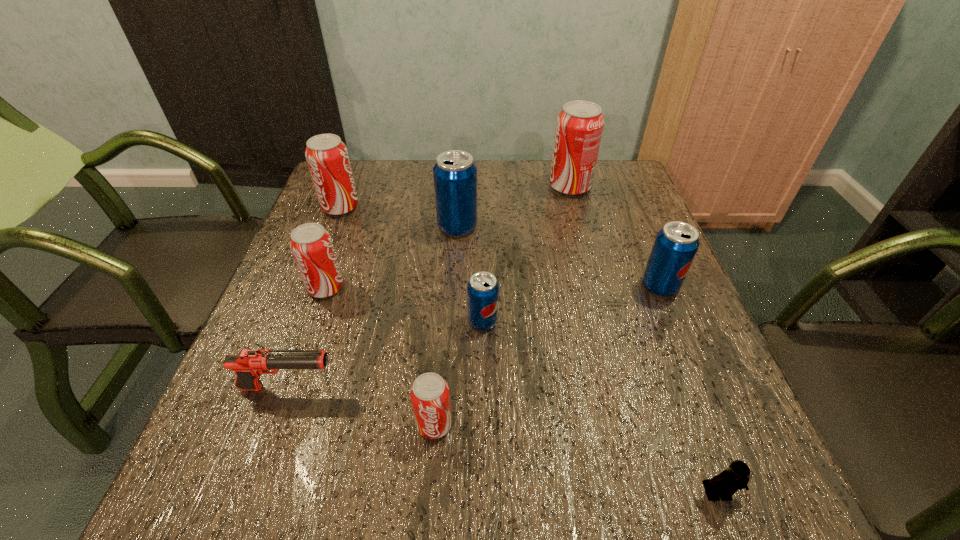
Where is `the eighth farthest object`? This screenshot has height=540, width=960. the eighth farthest object is located at coordinates (430, 397).

You are a GUI agent. You are given a task and a screenshot of the screen. Output one action in this format:
    pyautogui.click(x=<x>, y=<y>)
    Task: Click on the seventh farthest object
    Image resolution: width=960 pixels, height=540 pixels.
    Given the screenshot: What is the action you would take?
    pyautogui.click(x=248, y=364)

Where is `black gun`? This screenshot has height=540, width=960. black gun is located at coordinates (248, 364).

Where is `Lego`? This screenshot has width=960, height=540. Lego is located at coordinates (726, 484).

Find the location of `black Lego`. black Lego is located at coordinates (726, 484).

What are the coordinates of `free space located on the logo side of the rightmost red soda can` in the screenshot? It's located at (452, 187).

Where is `vacant region located 0.350m on the logo side of the rightmost red soda can`? This screenshot has width=960, height=540. vacant region located 0.350m on the logo side of the rightmost red soda can is located at coordinates (428, 187).

Locate an element on the screen. The width and height of the screenshot is (960, 540). free space located on the logo side of the rightmost red soda can is located at coordinates (455, 187).

Locate an element on the screen. The image size is (960, 540). vacant point located 0.210m on the logo side of the second biggest red soda can is located at coordinates (436, 207).

Locate an element on the screen. The width and height of the screenshot is (960, 540). free space located 0.110m on the back of the biggest blue pop soda is located at coordinates (460, 192).